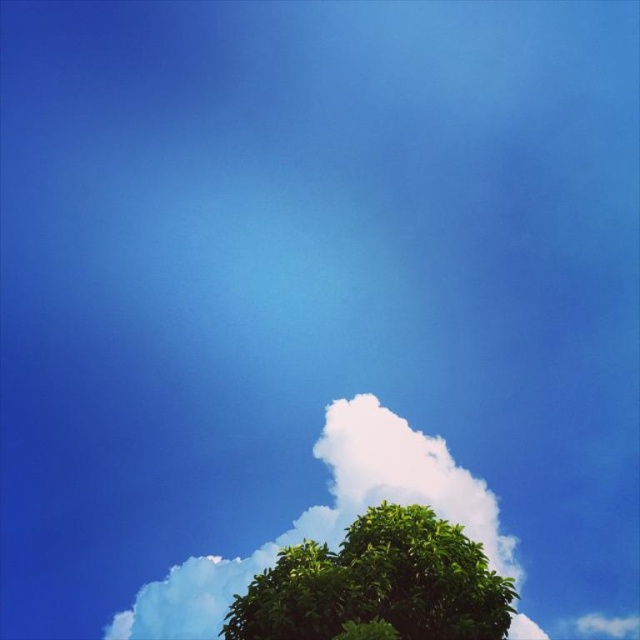
Question: Which object appears farthest from the camera in this image?

Choices:
 (A) green leafy tree at lower center
 (B) white fluffy cloud at lower center

Answer: (B)

Question: In this image, where is green leafy tree at lower center located relative to white fluffy cloud at lower center?

Choices:
 (A) below
 (B) above

Answer: (B)

Question: Does green leafy tree at lower center have a smaller size compared to white fluffy cloud at lower center?

Choices:
 (A) yes
 (B) no

Answer: (B)

Question: Which of the following is the farthest from the observer?

Choices:
 (A) white fluffy cloud at lower center
 (B) green leafy tree at lower center

Answer: (A)

Question: Can you confirm if green leafy tree at lower center is smaller than white fluffy cloud at lower center?

Choices:
 (A) no
 (B) yes

Answer: (A)